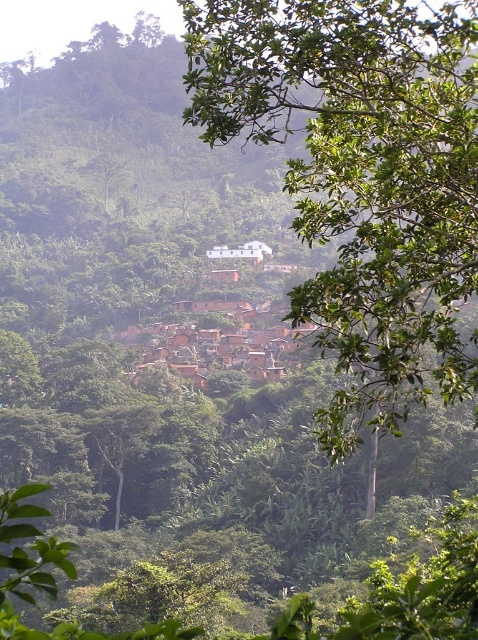
Question: Which point is closer to the camera?

Choices:
 (A) (434, 132)
 (B) (231, 358)

Answer: (A)

Question: Which point is farther to the camera?

Choices:
 (A) (431, 237)
 (B) (285, 348)

Answer: (B)

Question: Can you confirm if green leafy tree at upper center is wider than brown clay houses at center?

Choices:
 (A) no
 (B) yes

Answer: (B)

Question: Does green leafy tree at upper center appear on the left side of brown clay houses at center?

Choices:
 (A) no
 (B) yes

Answer: (A)

Question: Is green leafy tree at upper center behind brown clay houses at center?

Choices:
 (A) yes
 (B) no

Answer: (B)